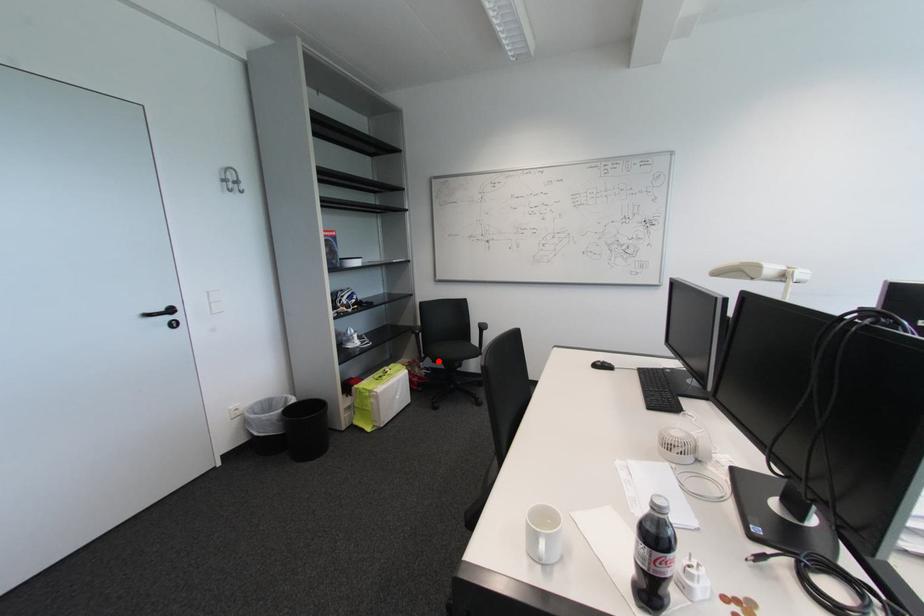
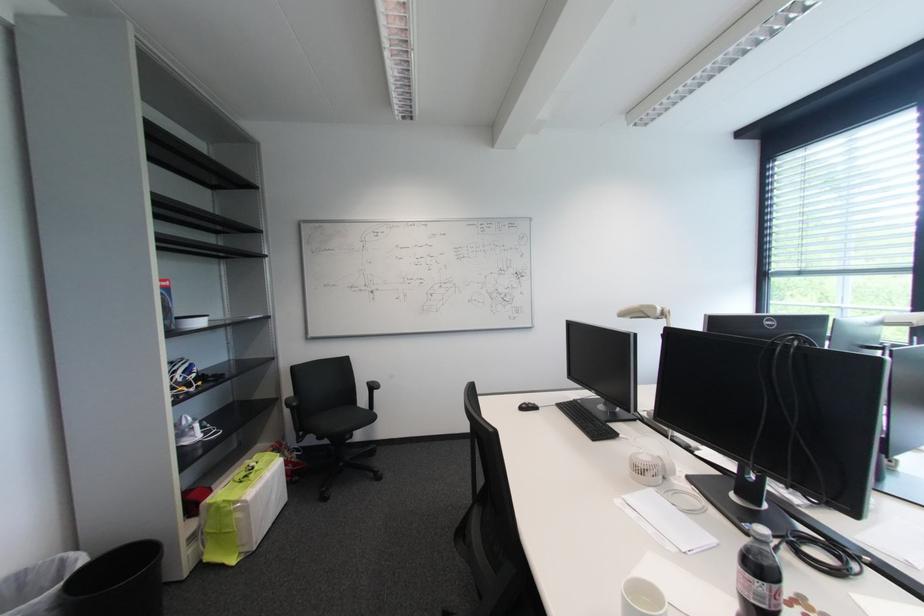
Locate, in the second image, the point that corresponds to the highlighted location in the first image.

(322, 438)